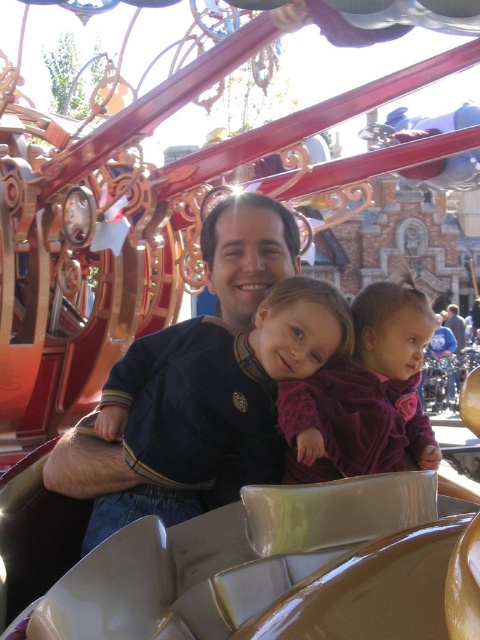
Question: Which point is farther to the camera?

Choices:
 (A) (399, 428)
 (B) (204, 353)

Answer: (B)

Question: Can you confirm if matte blue shirt at center is bigger than purple velvet dress at center?

Choices:
 (A) no
 (B) yes

Answer: (B)

Question: Which point is closer to the camera?

Choices:
 (A) matte blue shirt at center
 (B) purple velvet dress at center

Answer: (B)

Question: Does matte blue shirt at center appear on the left side of purple velvet dress at center?

Choices:
 (A) no
 (B) yes

Answer: (B)

Question: Is matte blue shirt at center below purple velvet dress at center?

Choices:
 (A) yes
 (B) no

Answer: (B)